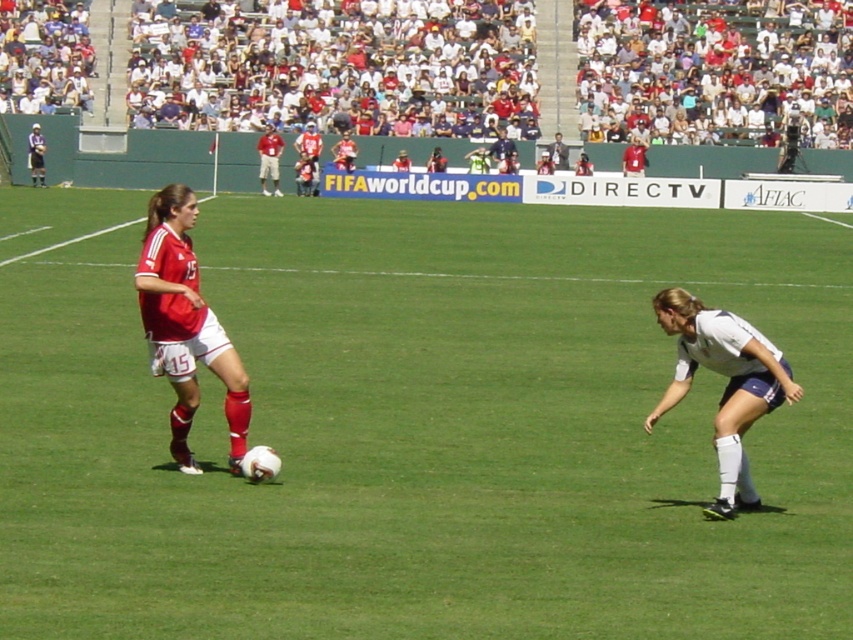
Which is in front, point (0, 246) or point (364, 124)?

Point (0, 246) is more forward.

Is point (258, 596) behind point (241, 60)?

No, it is in front of (241, 60).

From the picture: Who is more distant from viewer, [585,468] or [183,106]?

Positioned behind is point [183,106].

Where is `green grass soccer field at center`? Image resolution: width=853 pixels, height=640 pixels. green grass soccer field at center is located at coordinates (428, 429).

Is white cotton crowd at upper center smaller than matte red jersey at left?

No.

Does white cotton crowd at upper center have a lesser width compared to matte red jersey at left?

No.

I want to click on white cotton crowd at upper center, so click(x=335, y=65).

Who is higher up, green grass soccer field at center or matte red jersey at left?

green grass soccer field at center

From the picture: Does green grass soccer field at center have a smaller size compared to matte red jersey at left?

No, green grass soccer field at center is not smaller than matte red jersey at left.

Is point (0, 621) positioned in front of point (167, 356)?

Yes, it is.

Find the location of `green grass soccer field at center`. green grass soccer field at center is located at coordinates (428, 429).